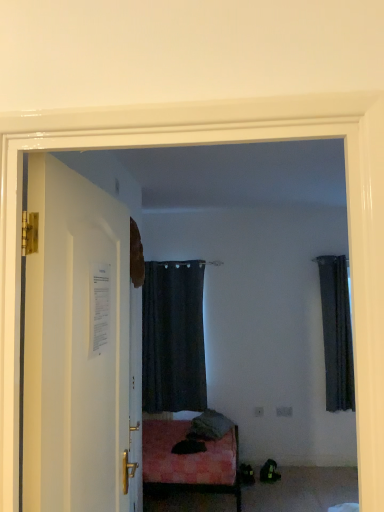
Question: Can you confirm if black fabric curtain at center, acting as the first curtain starting from the left, is shorter than dark fabric curtain at right, marked as the first curtain in a right-to-left arrangement?

Choices:
 (A) no
 (B) yes

Answer: (A)

Question: Can you confirm if black fabric curtain at center, acting as the first curtain starting from the left, is positioned to the right of dark fabric curtain at right, the 2th curtain in the left-to-right sequence?

Choices:
 (A) yes
 (B) no

Answer: (B)

Question: From the image's perspective, is black fabric curtain at center, acting as the first curtain starting from the left, above dark fabric curtain at right, marked as the first curtain in a right-to-left arrangement?

Choices:
 (A) yes
 (B) no

Answer: (B)

Question: Is black fabric curtain at center, acting as the first curtain starting from the left, aimed at dark fabric curtain at right, the 2th curtain in the left-to-right sequence?

Choices:
 (A) no
 (B) yes

Answer: (A)

Question: Is black fabric curtain at center, acting as the first curtain starting from the left, with dark fabric curtain at right, marked as the first curtain in a right-to-left arrangement?

Choices:
 (A) yes
 (B) no

Answer: (B)

Question: Is dark fabric curtain at right, the 2th curtain in the left-to-right sequence, inside black fabric curtain at center, acting as the first curtain starting from the left?

Choices:
 (A) yes
 (B) no

Answer: (B)

Question: Is white glossy door at left taller than black fabric curtain at center, which is the 2th curtain in right-to-left order?

Choices:
 (A) no
 (B) yes

Answer: (A)

Question: Is white glossy door at left bigger than black fabric curtain at center, acting as the first curtain starting from the left?

Choices:
 (A) no
 (B) yes

Answer: (A)

Question: From a real-world perspective, is white glossy door at left located higher than black fabric curtain at center, acting as the first curtain starting from the left?

Choices:
 (A) yes
 (B) no

Answer: (A)

Question: From the image's perspective, does white glossy door at left appear higher than black fabric curtain at center, which is the 2th curtain in right-to-left order?

Choices:
 (A) no
 (B) yes

Answer: (B)

Question: Can black fabric curtain at center, acting as the first curtain starting from the left, be found inside white glossy door at left?

Choices:
 (A) no
 (B) yes

Answer: (A)

Question: From the image's perspective, does white glossy door at left appear lower than black fabric curtain at center, acting as the first curtain starting from the left?

Choices:
 (A) no
 (B) yes

Answer: (A)

Question: Is dark fabric curtain at right, marked as the first curtain in a right-to-left arrangement, completely or partially outside of black fabric curtain at center, which is the 2th curtain in right-to-left order?

Choices:
 (A) no
 (B) yes

Answer: (B)